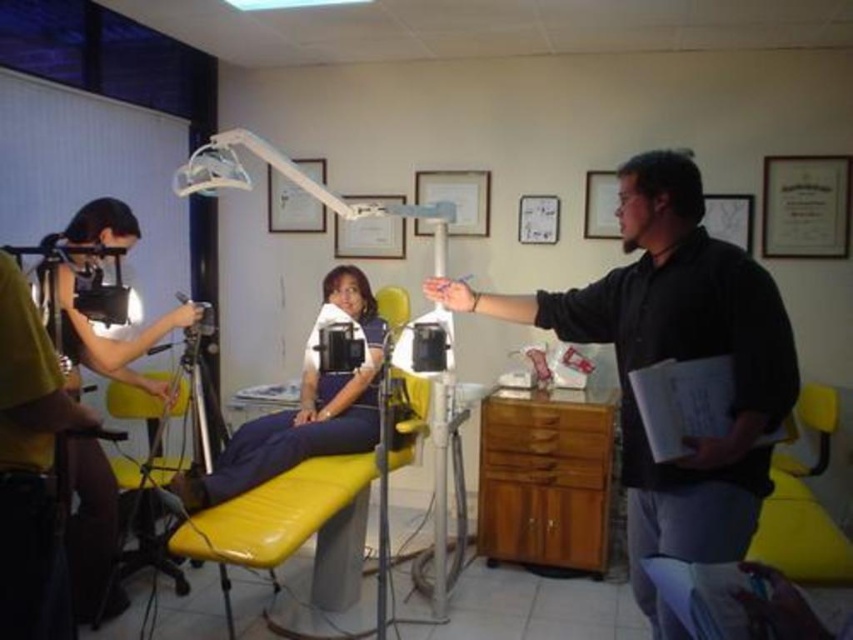
Which is below, black matte dentist at center or matte black camera at left?

Positioned lower is black matte dentist at center.

Can you confirm if black matte dentist at center is positioned below matte black camera at left?

Correct, black matte dentist at center is located below matte black camera at left.

What do you see at coordinates (676, 358) in the screenshot? The width and height of the screenshot is (853, 640). I see `black matte dentist at center` at bounding box center [676, 358].

I want to click on black matte dentist at center, so click(x=676, y=358).

Is black matte dentist at center shorter than yellow vinyl chair at center?

In fact, black matte dentist at center may be taller than yellow vinyl chair at center.

Does black matte dentist at center appear under yellow vinyl chair at center?

Actually, black matte dentist at center is above yellow vinyl chair at center.

The height and width of the screenshot is (640, 853). I want to click on black matte dentist at center, so click(676, 358).

Can you confirm if yellow vinyl chair at center is positioned below matte black camera at left?

Correct, yellow vinyl chair at center is located below matte black camera at left.

Is point (397, 410) farther from viewer compared to point (93, 560)?

Yes, it is.

Between point (265, 532) and point (106, 602), which one is positioned behind?

Positioned behind is point (106, 602).

Locate an element on the screen. yellow vinyl chair at center is located at coordinates (308, 500).